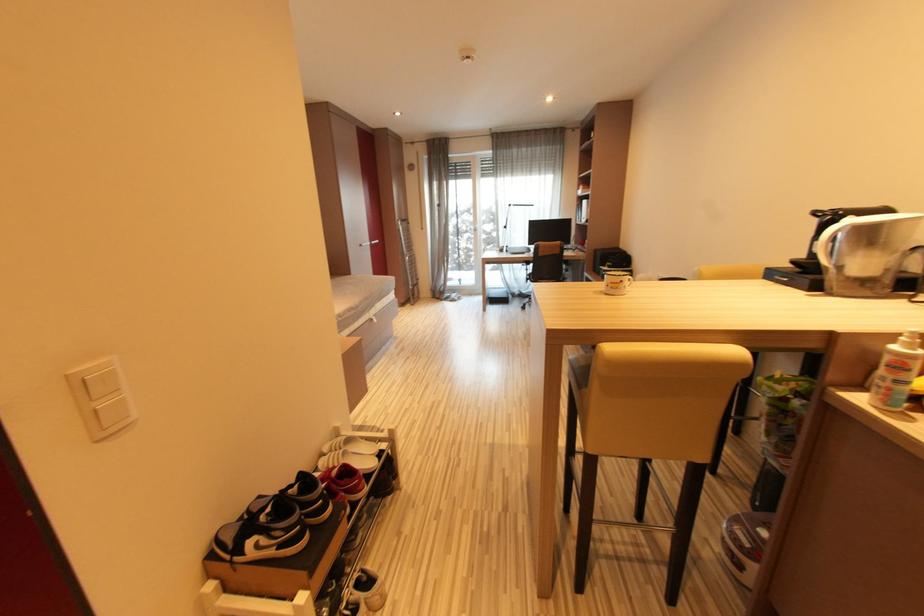
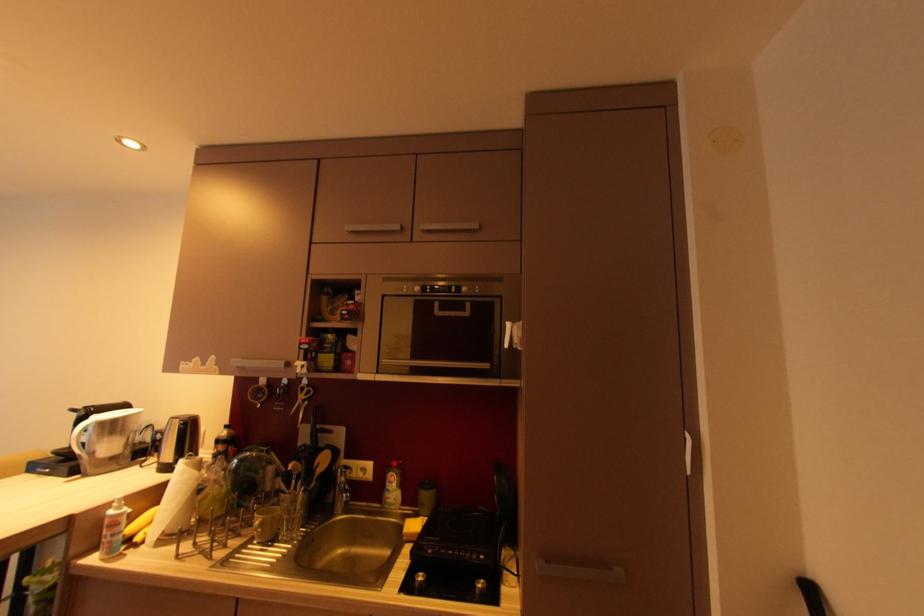
Question: The first image is from the beginning of the video and the second image is from the end. How did the camera likely rotate when shooting the video?

Choices:
 (A) Left
 (B) Right
 (C) Up
 (D) Down

Answer: (B)